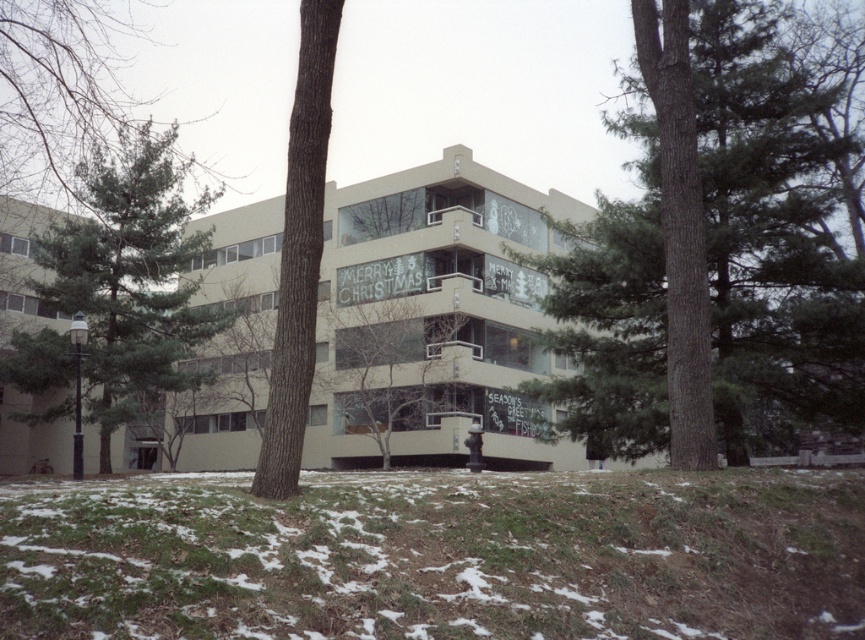
Between green leafy tree at upper left and green leafy tree at center, which one has more height?

With more height is green leafy tree at upper left.

What do you see at coordinates (61, 90) in the screenshot? I see `green leafy tree at upper left` at bounding box center [61, 90].

The width and height of the screenshot is (865, 640). Find the location of `green leafy tree at upper left`. green leafy tree at upper left is located at coordinates (61, 90).

Looking at this image, does green textured tree at center appear on the left side of green leafy tree at upper left?

No, green textured tree at center is not to the left of green leafy tree at upper left.

Locate an element on the screen. Image resolution: width=865 pixels, height=640 pixels. green textured tree at center is located at coordinates (719, 244).

What do you see at coordinates (719, 244) in the screenshot? I see `green textured tree at center` at bounding box center [719, 244].

Where is `green textured tree at center`? The height and width of the screenshot is (640, 865). green textured tree at center is located at coordinates [x=719, y=244].

Who is higher up, green leafy tree at upper left or brown rough bark tree at center?

green leafy tree at upper left is higher up.

Does green leafy tree at upper left have a larger size compared to brown rough bark tree at center?

Yes, green leafy tree at upper left is bigger than brown rough bark tree at center.

Image resolution: width=865 pixels, height=640 pixels. What do you see at coordinates (61, 90) in the screenshot?
I see `green leafy tree at upper left` at bounding box center [61, 90].

Locate an element on the screen. The height and width of the screenshot is (640, 865). green leafy tree at upper left is located at coordinates (61, 90).